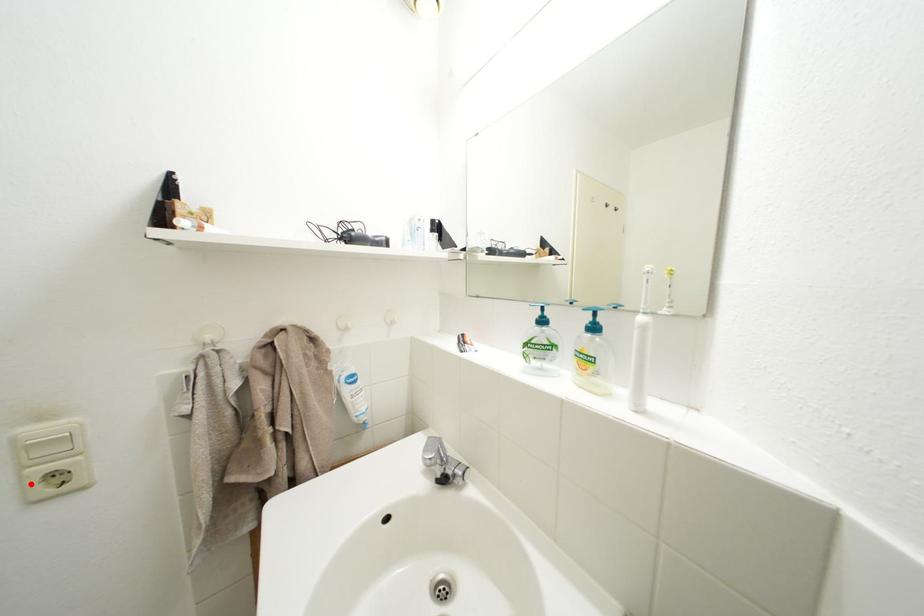
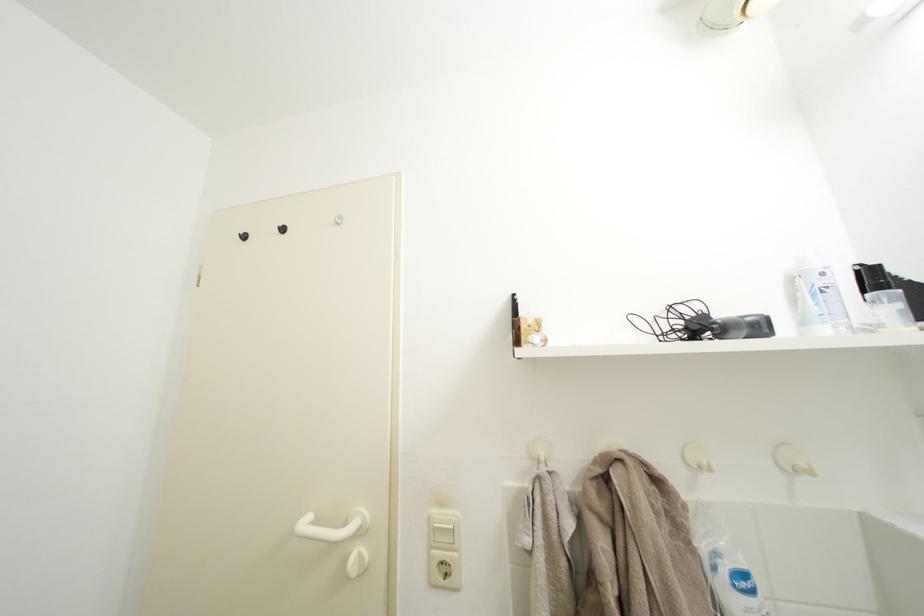
In the second image, find the point that corresponds to the highlighted location in the first image.

(439, 562)